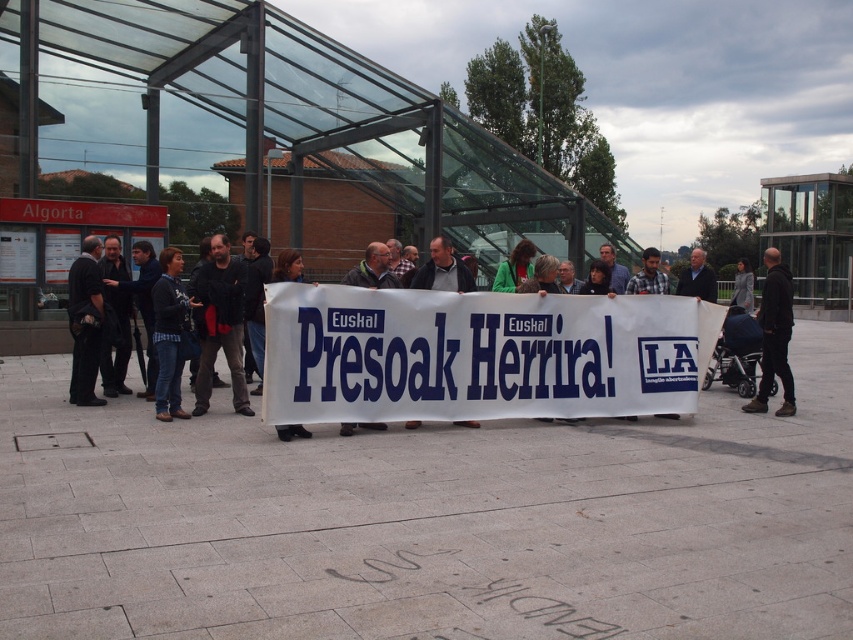
You are a photographer positioned at the front of the crowd. You want to take a photo of the matte black banner at center and the gray wool coat at center. Which object will appear larger in your photo?

The matte black banner at center will appear larger in the photo because it is closer to the viewer than the gray wool coat at center.